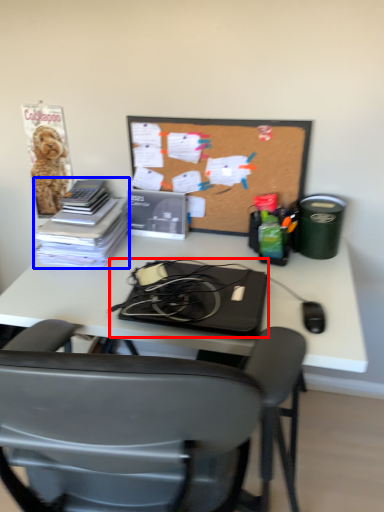
Question: Which point is closer to the camera, laptop (highlighted by a red box) or book (highlighted by a blue box)?

Choices:
 (A) laptop
 (B) book

Answer: (A)